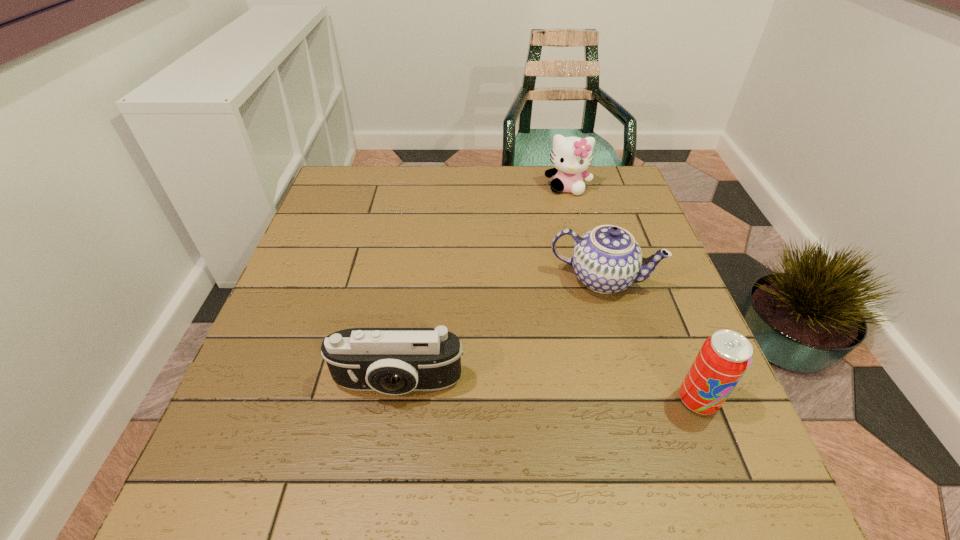
Locate an element on the screen. free spot at the far edge of the desktop is located at coordinates (461, 200).

Locate an element on the screen. vacant space at the near edge of the desktop is located at coordinates (516, 416).

At what (x,y) coordinates should I click in order to perform the action: click on vacant position at the left edge of the desktop. Please return your answer as a coordinate pair (x, y). This screenshot has width=960, height=540. Looking at the image, I should click on (313, 225).

The height and width of the screenshot is (540, 960). Find the location of `vacant space at the right edge`. vacant space at the right edge is located at coordinates (683, 374).

Identify the location of vacant space at the far left corner of the desktop. Image resolution: width=960 pixels, height=540 pixels. (327, 188).

Where is `free space at the near left corner of the desktop`? The height and width of the screenshot is (540, 960). free space at the near left corner of the desktop is located at coordinates (289, 437).

This screenshot has height=540, width=960. What are the coordinates of `free space at the far right corner of the desktop` in the screenshot? It's located at (612, 176).

You are a GUI agent. You are given a task and a screenshot of the screen. Output one action in this format:
    pyautogui.click(x=<x>, y=<y>)
    Task: Click on the free spot at the near right corner of the desktop
    
    Given the screenshot: What is the action you would take?
    pyautogui.click(x=675, y=431)

Locate an element on the screen. free space between the second farthest object and the camera is located at coordinates (500, 332).

You are a GUI agent. You are given a task and a screenshot of the screen. Output one action in this format:
    pyautogui.click(x=<x>, y=<y>)
    Task: Click on the vacant area that lies between the soda can and the chinaware
    
    Given the screenshot: What is the action you would take?
    pyautogui.click(x=650, y=340)